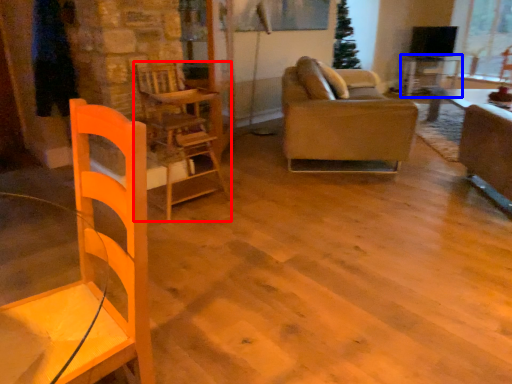
Question: Among these objects, which one is farthest to the camera, chair (highlighted by a red box) or table (highlighted by a blue box)?

Choices:
 (A) chair
 (B) table

Answer: (B)